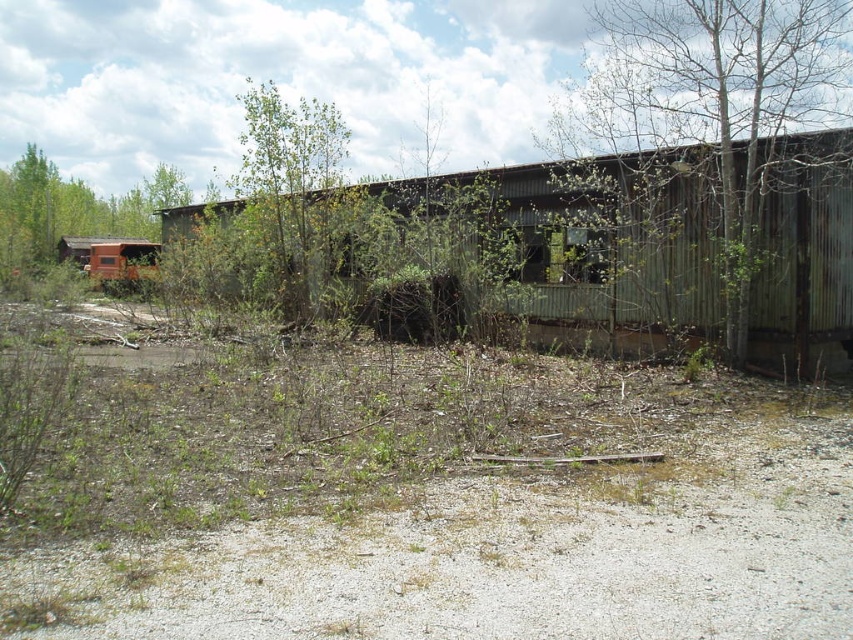
Question: Is rusty corrugated metal hut at center positioned in front of green leafy tree at center?

Choices:
 (A) yes
 (B) no

Answer: (A)

Question: Which object is closer to the camera taking this photo?

Choices:
 (A) green leafy tree at center
 (B) green textured tree at upper right

Answer: (B)

Question: Is rusty corrugated metal hut at center below green textured tree at upper right?

Choices:
 (A) yes
 (B) no

Answer: (A)

Question: Among these objects, which one is nearest to the camera?

Choices:
 (A) green leafy tree at center
 (B) rusty corrugated metal hut at center
 (C) brown wood tree at left

Answer: (B)

Question: Can you confirm if rusty corrugated metal hut at center is bigger than green leafy tree at center?

Choices:
 (A) yes
 (B) no

Answer: (B)

Question: Which of the following is the closest to the observer?

Choices:
 (A) rusty corrugated metal hut at center
 (B) green textured tree at upper right
 (C) green leafy tree at center
 (D) brown wood tree at left

Answer: (A)